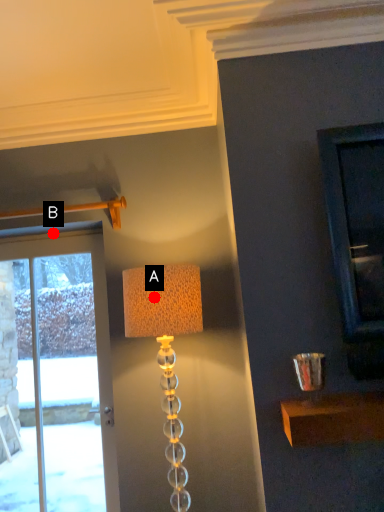
Question: Two points are circled on the image, labeled by A and B beside each circle. Which of the following is the closest to the observer?

Choices:
 (A) A is closer
 (B) B is closer

Answer: (A)